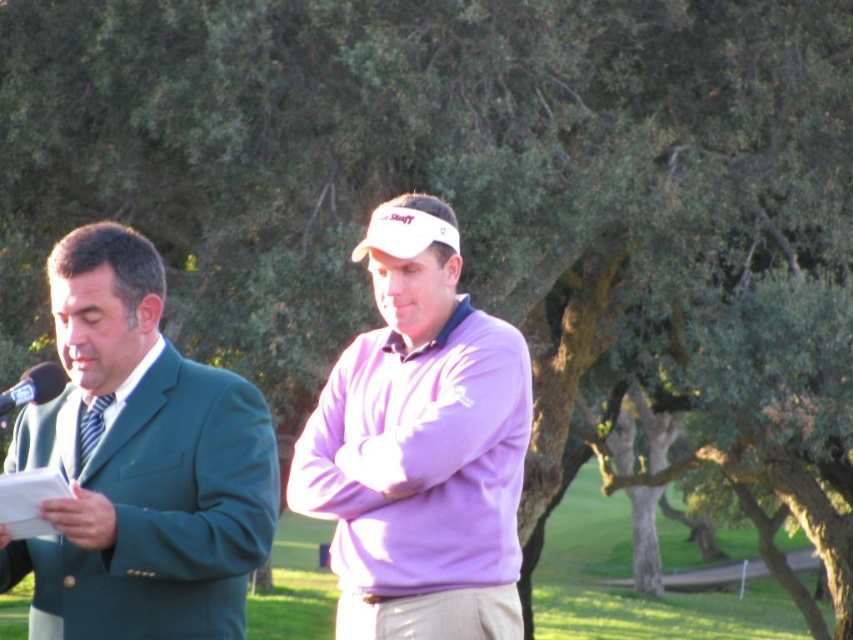
Who is taller, green suit at left or striped fabric tie at left?

Standing taller between the two is green suit at left.

Can you confirm if green suit at left is thinner than striped fabric tie at left?

No.

Identify the location of green suit at left. Image resolution: width=853 pixels, height=640 pixels. [x=140, y=465].

In the scene shown: Is green suit at left shorter than black plastic microphone at left?

No, green suit at left is not shorter than black plastic microphone at left.

At what (x,y) coordinates should I click in order to perform the action: click on green suit at left. Please return your answer as a coordinate pair (x, y). Looking at the image, I should click on (140, 465).

What do you see at coordinates (630, 584) in the screenshot? I see `green grass at center` at bounding box center [630, 584].

Which is below, green grass at center or black plastic microphone at left?

green grass at center is lower down.

Is point (608, 566) positioned before point (20, 378)?

No.

Locate an element on the screen. Image resolution: width=853 pixels, height=640 pixels. green grass at center is located at coordinates (630, 584).